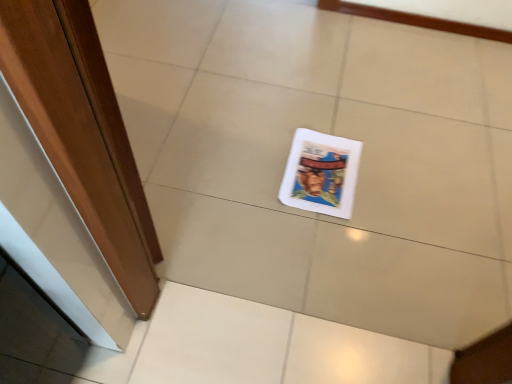
Find the location of a particular element. The image size is (512, 384). vacant space to the right of wooden door at left is located at coordinates (252, 180).